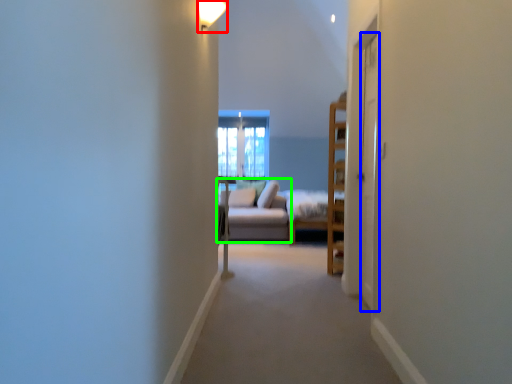
Question: Which object is the closest to the light fixture (highlighted by a red box)? Choose among these: screen door (highlighted by a blue box) or studio couch (highlighted by a green box).

Choices:
 (A) screen door
 (B) studio couch

Answer: (A)